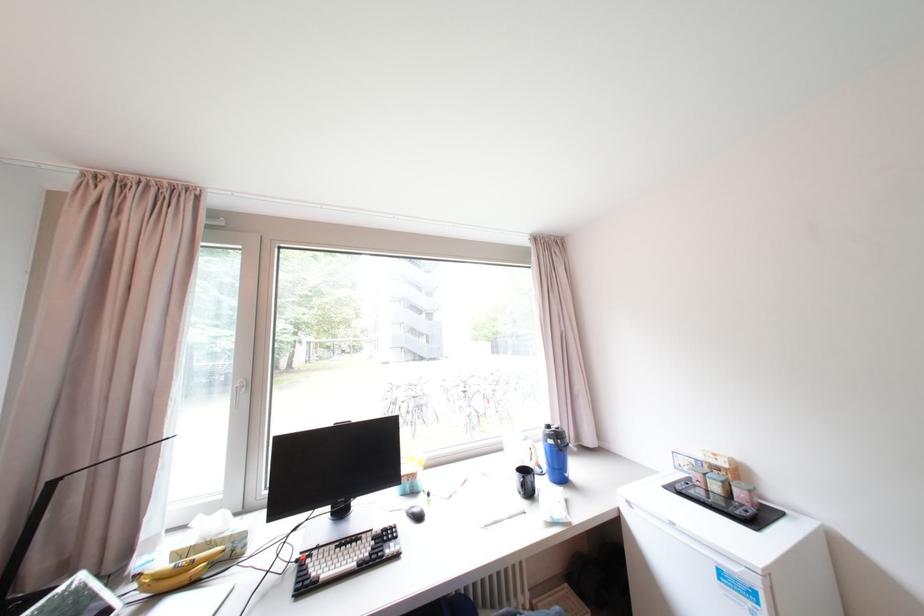
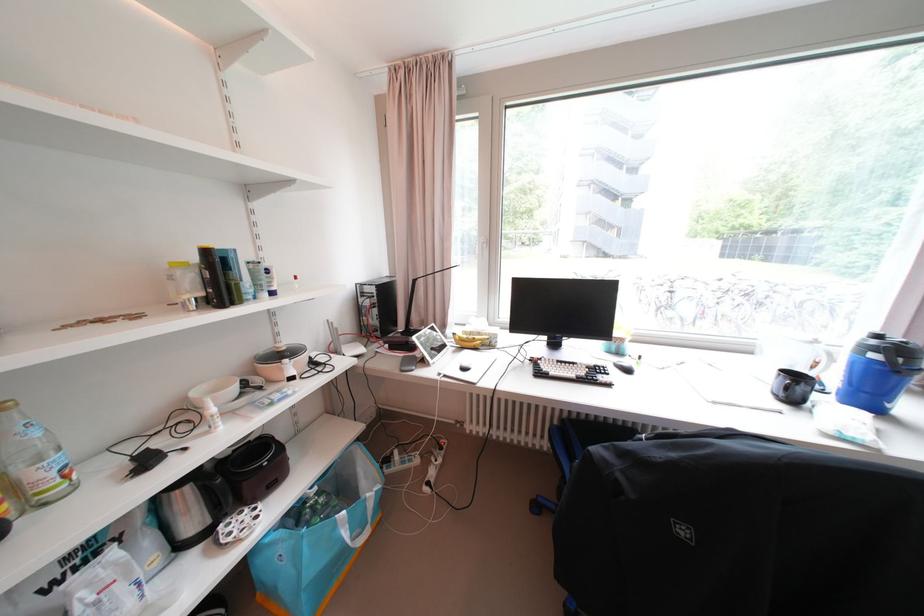
Locate, in the second image, the point that corresponds to (x=531, y=477) in the first image.

(800, 382)